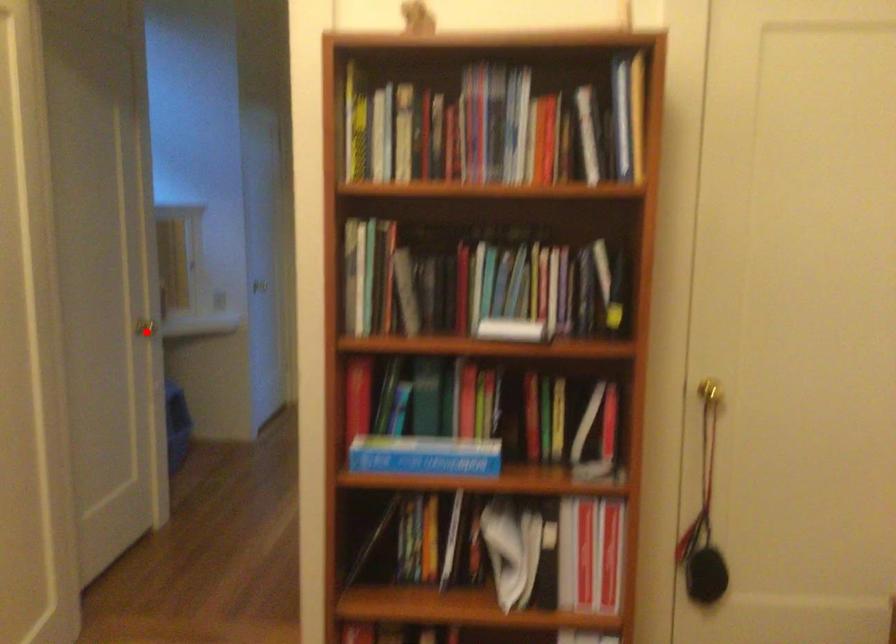
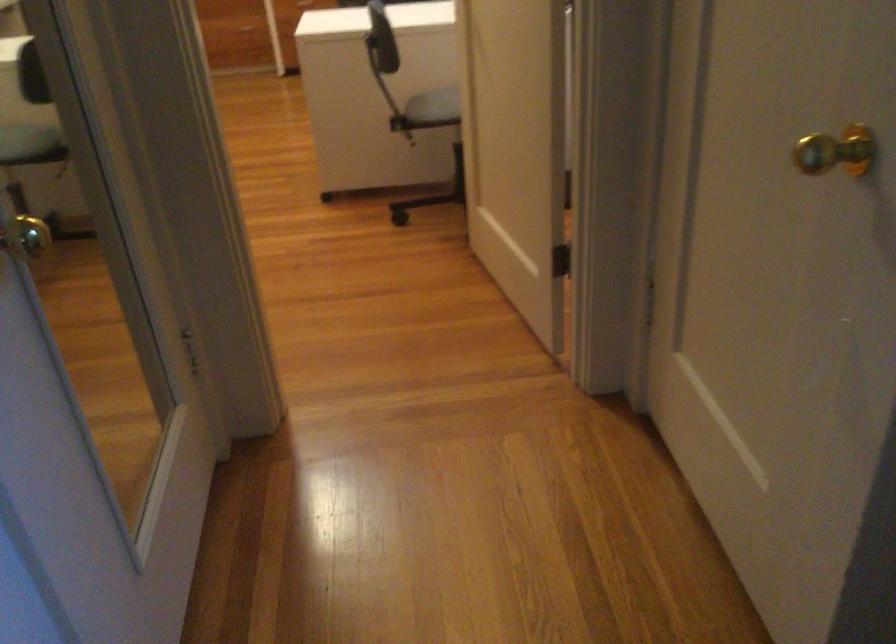
Question: I am providing you with two images of the same scene from different viewpoints. Image1 has a red point marked. In image2, the corresponding 3D location appears at what relative position? Reply with the corresponding letter.

Choices:
 (A) Closer
 (B) Farther

Answer: (A)